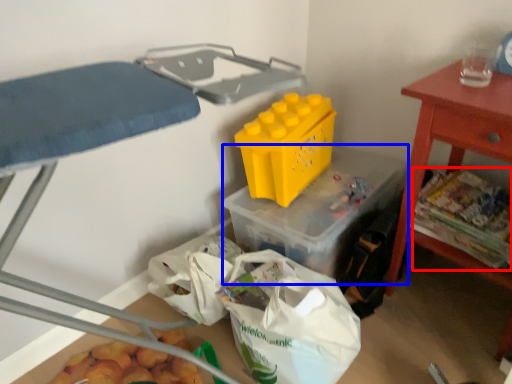
Question: Which object appears closest to the camera in this image, food (highlighted by a red box) or storage box (highlighted by a blue box)?

Choices:
 (A) food
 (B) storage box

Answer: (A)